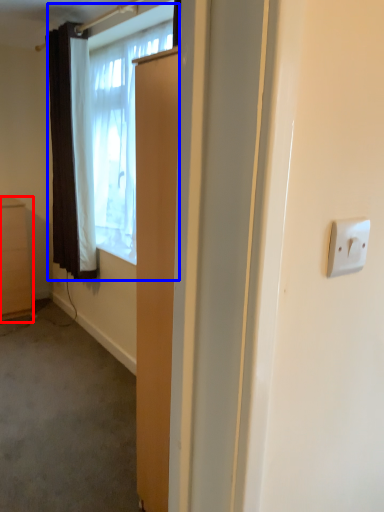
Question: Which of the following is the farthest to the observer, cabinetry (highlighted by a red box) or window (highlighted by a blue box)?

Choices:
 (A) cabinetry
 (B) window

Answer: (A)